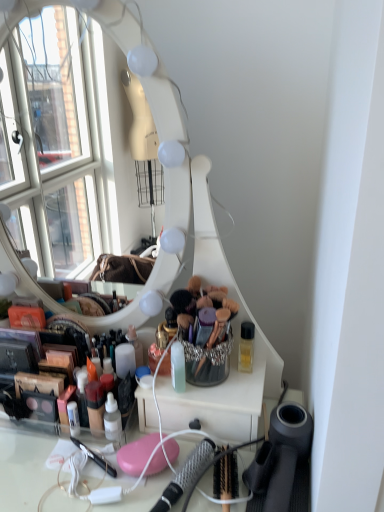
Question: Is metallic silver hairbrush at lower center to the right of shiny plastic makeup at center from the viewer's perspective?

Choices:
 (A) yes
 (B) no

Answer: (A)

Question: Is metallic silver hairbrush at lower center facing away from shiny plastic makeup at center?

Choices:
 (A) yes
 (B) no

Answer: (B)

Question: From a real-world perspective, is metallic silver hairbrush at lower center positioned under shiny plastic makeup at center based on gravity?

Choices:
 (A) yes
 (B) no

Answer: (A)

Question: Is metallic silver hairbrush at lower center facing towards shiny plastic makeup at center?

Choices:
 (A) yes
 (B) no

Answer: (B)

Question: Is metallic silver hairbrush at lower center taller than shiny plastic makeup at center?

Choices:
 (A) yes
 (B) no

Answer: (B)

Question: Is there a large distance between metallic silver hairbrush at lower center and shiny plastic makeup at center?

Choices:
 (A) no
 (B) yes

Answer: (A)

Question: From the image's perspective, does shiny plastic makeup at center appear lower than metallic silver hairbrush at lower center?

Choices:
 (A) no
 (B) yes

Answer: (A)

Question: Considering the relative sizes of shiny plastic makeup at center and metallic silver hairbrush at lower center in the image provided, is shiny plastic makeup at center taller than metallic silver hairbrush at lower center?

Choices:
 (A) no
 (B) yes

Answer: (B)

Question: Is metallic silver hairbrush at lower center located within shiny plastic makeup at center?

Choices:
 (A) yes
 (B) no

Answer: (B)

Question: Can you confirm if shiny plastic makeup at center is bigger than metallic silver hairbrush at lower center?

Choices:
 (A) yes
 (B) no

Answer: (A)

Question: Does shiny plastic makeup at center turn towards metallic silver hairbrush at lower center?

Choices:
 (A) no
 (B) yes

Answer: (A)

Question: Is shiny plastic makeup at center to the right of metallic silver hairbrush at lower center from the viewer's perspective?

Choices:
 (A) yes
 (B) no

Answer: (B)

Question: Is point (183, 466) positioned closer to the camera than point (59, 382)?

Choices:
 (A) closer
 (B) farther

Answer: (A)